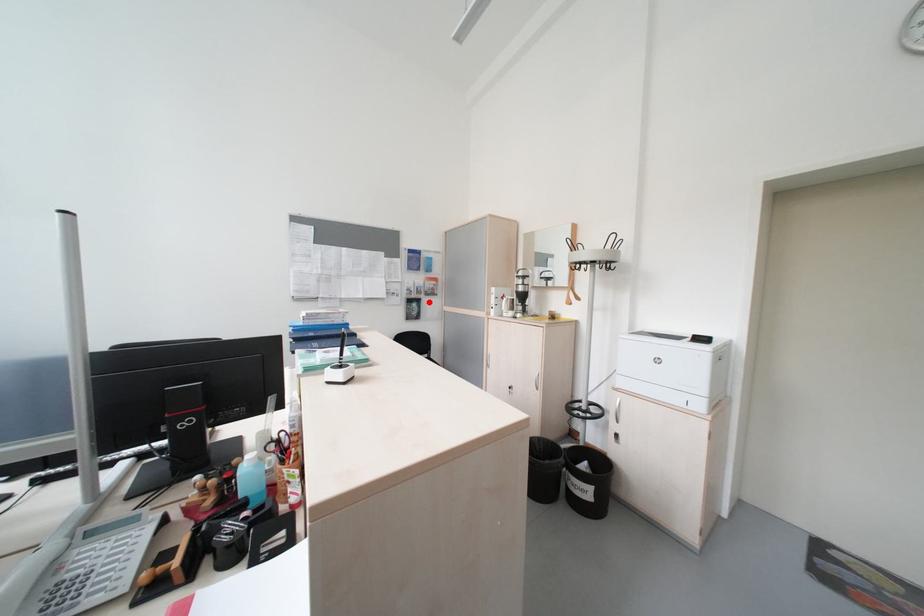
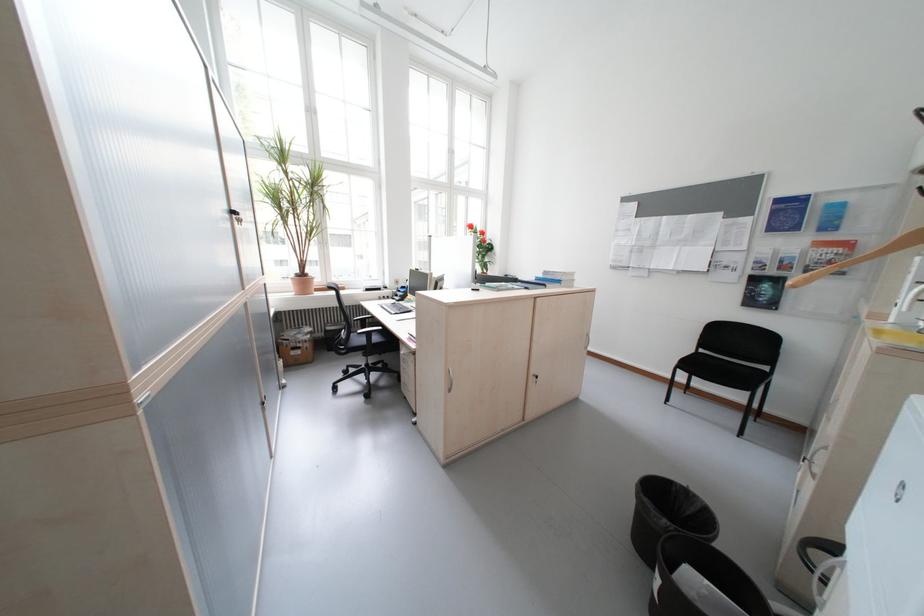
Where in the second image is the point corresponding to the highlighted location from the first image?

(788, 282)